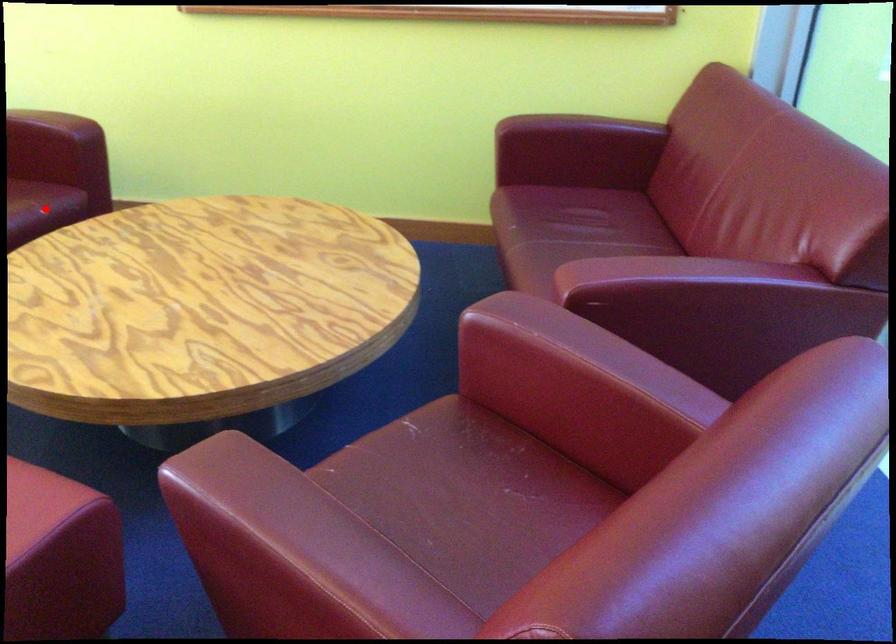
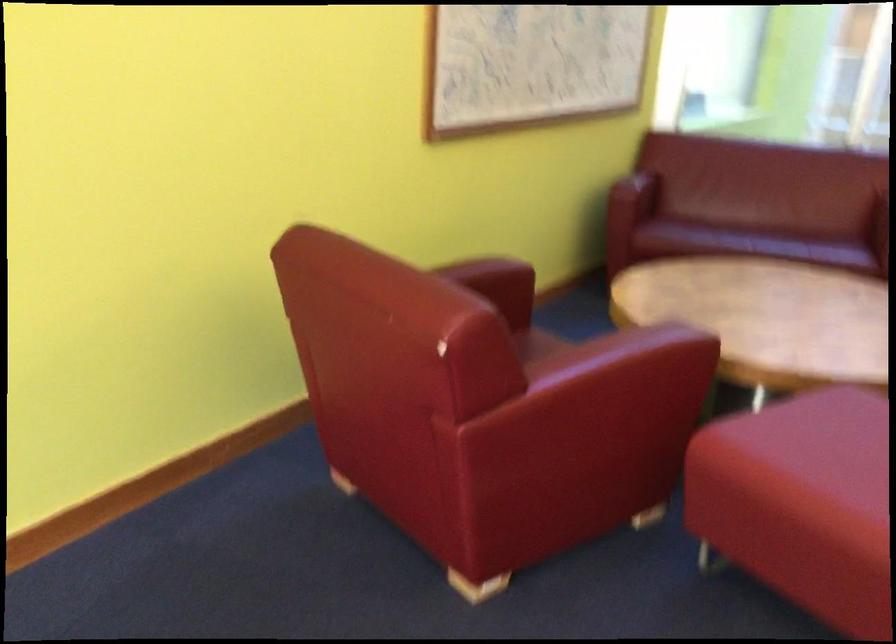
Question: I am providing you with two images of the same scene from different viewpoints. A red point is marked on the first image. At the location where the point appears in image 1, is it still visible in image 2?

Choices:
 (A) Yes
 (B) No

Answer: (B)